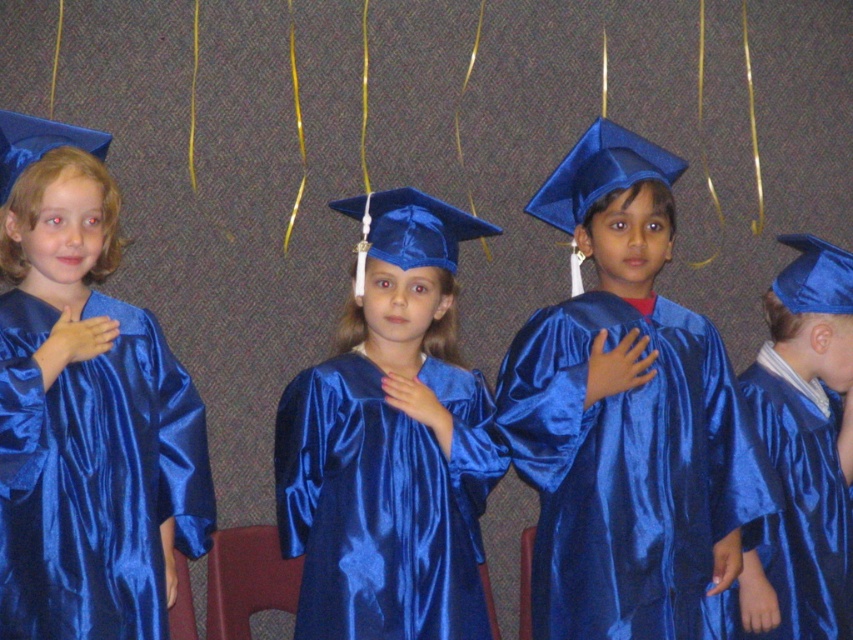
You are a photographer trying to capture a clear shot of the shiny blue graduation gown at center and the blue satin cap at upper right. Since both items are reflective, you need to adjust your camera settings. Which item might require more careful adjustment to avoid overexposure due to its reflective surface?

The shiny blue graduation gown at center might require more careful adjustment because it has a greater height and thus a larger reflective surface area compared to the blue satin cap at upper right.

You are a photographer taking a picture of the graduation ceremony. You want to capture both the satin blue gown at left and the satin blue gown at center in the same frame. Which direction should you move your camera to ensure both gowns are visible?

The satin blue gown at left is to the left of the satin blue gown at center. To capture both in the same frame, you should position your camera so it faces towards the center area where both gowns are aligned horizontally, ensuring the camera is centered between them or adjusted to include both sides.

You are a photographer taking pictures of the graduation ceremony. You need to ensure that the shiny blue graduation gown at center and the blue satin cap at upper right are both clearly visible in the photo. Based on their positions, which object is closer to the camera?

The shiny blue graduation gown at center is positioned under the blue satin cap at upper right, meaning the blue satin cap at upper right is closer to the camera.